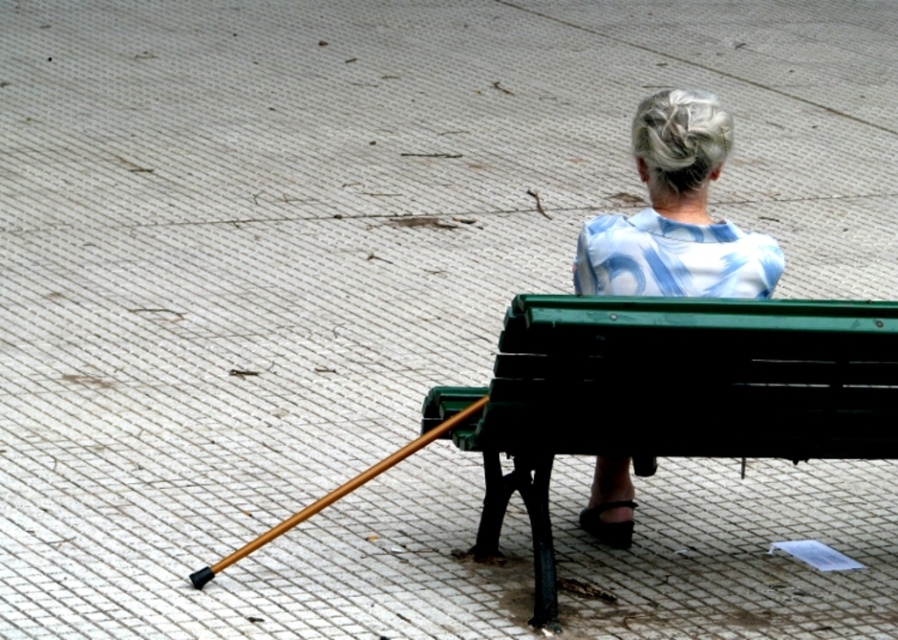
Can you confirm if green painted wood bench at center is thinner than blue patterned blouse at center?

No.

Does green painted wood bench at center have a greater height compared to blue patterned blouse at center?

Yes, green painted wood bench at center is taller than blue patterned blouse at center.

Identify the location of green painted wood bench at center. This screenshot has height=640, width=898. (668, 394).

Find the location of `green painted wood bench at center`. green painted wood bench at center is located at coordinates (668, 394).

Can you confirm if green painted wood bench at center is smaller than wooden cane at lower left?

Incorrect, green painted wood bench at center is not smaller in size than wooden cane at lower left.

Does green painted wood bench at center have a greater width compared to wooden cane at lower left?

Correct, the width of green painted wood bench at center exceeds that of wooden cane at lower left.

Is point (753, 454) positioned in front of point (342, 483)?

Yes, point (753, 454) is in front of point (342, 483).

At what (x,y) coordinates should I click in order to perform the action: click on green painted wood bench at center. Please return your answer as a coordinate pair (x, y). Looking at the image, I should click on (668, 394).

Between point (700, 164) and point (192, 586), which one is positioned in front?

Point (700, 164) is in front.

Based on the photo, does blue patterned blouse at center appear on the left side of wooden cane at lower left?

In fact, blue patterned blouse at center is to the right of wooden cane at lower left.

You are a GUI agent. You are given a task and a screenshot of the screen. Output one action in this format:
    pyautogui.click(x=<x>, y=<y>)
    Task: Click on the blue patterned blouse at center
    Image resolution: width=898 pixels, height=640 pixels.
    Given the screenshot: What is the action you would take?
    pyautogui.click(x=676, y=214)

I want to click on blue patterned blouse at center, so click(x=676, y=214).